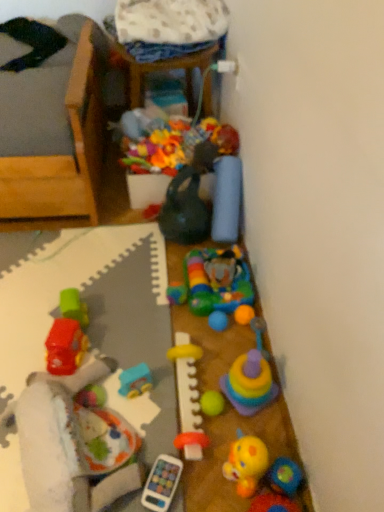
You are a GUI agent. You are given a task and a screenshot of the screen. Output one action in this format:
    pyautogui.click(x=<x>, y=<y>)
    Task: Click on the free space in front of matte green kettle at center, the 3th toy from the left
    The height and width of the screenshot is (512, 384).
    Given the screenshot: What is the action you would take?
    pyautogui.click(x=162, y=266)